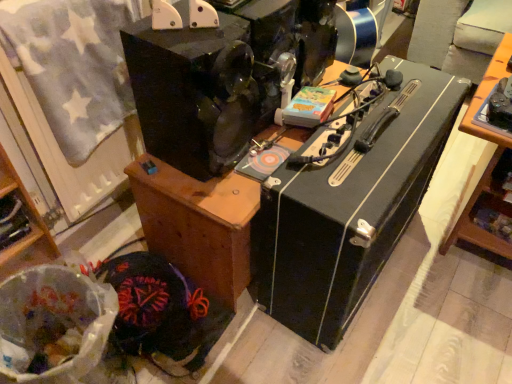
Question: Looking at the image, does black hard case at center seem bigger or smaller compared to velvet-like fabric at lower left, which is the first waste in back-to-front order?

Choices:
 (A) big
 (B) small

Answer: (A)

Question: From the image's perspective, is black hard case at center located above or below velvet-like fabric at lower left, which is the first waste in back-to-front order?

Choices:
 (A) below
 (B) above

Answer: (B)

Question: Considering the real-world distances, which object is farthest from the black matte speaker at center, which is the 2th furniture in left-to-right order?

Choices:
 (A) velvet-like fabric at lower left, the second waste viewed from the front
 (B) wooden cabinet at lower left, marked as the second furniture in a right-to-left arrangement
 (C) translucent plastic bag at lower left, placed as the second waste when sorted from back to front
 (D) black hard case at center

Answer: (B)

Question: Which of these objects is positioned closest to the translucent plastic bag at lower left, placed as the second waste when sorted from back to front?

Choices:
 (A) velvet-like fabric at lower left, which is the first waste in back-to-front order
 (B) black hard case at center
 (C) black matte speaker at center, which is the 2th furniture in left-to-right order
 (D) wooden cabinet at lower left, marked as the second furniture in a right-to-left arrangement

Answer: (A)